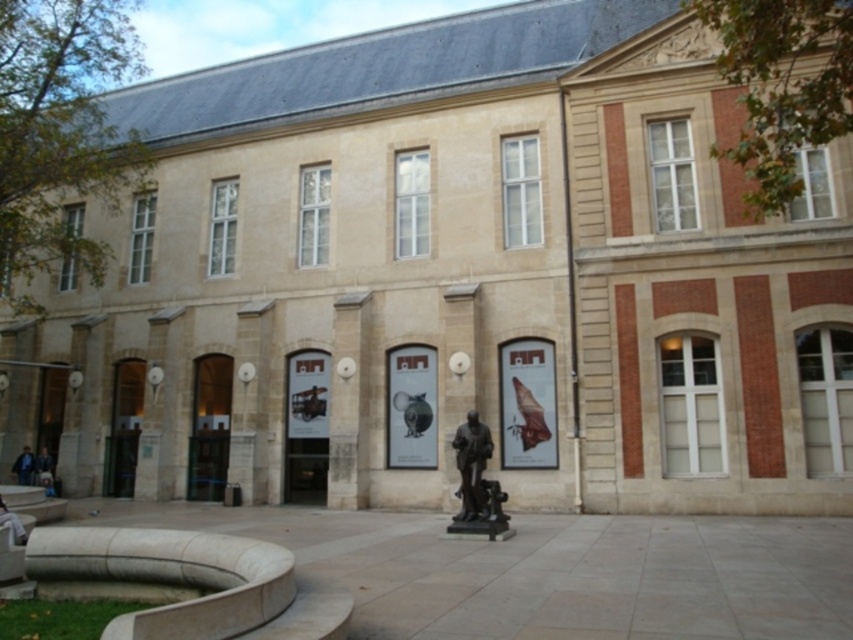
Question: Does bronze statue at center have a greater width compared to blue denim jacket at lower left?

Choices:
 (A) no
 (B) yes

Answer: (B)

Question: Which is farther from the blue denim jacket at lower left?

Choices:
 (A) light blue jeans at lower left
 (B) dark blue fabric jacket at lower left
 (C) bronze statue at center

Answer: (C)

Question: Where is light blue jeans at lower left located in relation to blue denim jacket at lower left in the image?

Choices:
 (A) right
 (B) left

Answer: (A)

Question: Which point appears closest to the camera in this image?

Choices:
 (A) (21, 460)
 (B) (3, 515)

Answer: (B)

Question: Which of these objects is positioned closest to the light blue jeans at lower left?

Choices:
 (A) dark blue fabric jacket at lower left
 (B) bronze statue at center

Answer: (B)

Question: Is bronze statue at center smaller than light blue jeans at lower left?

Choices:
 (A) yes
 (B) no

Answer: (B)